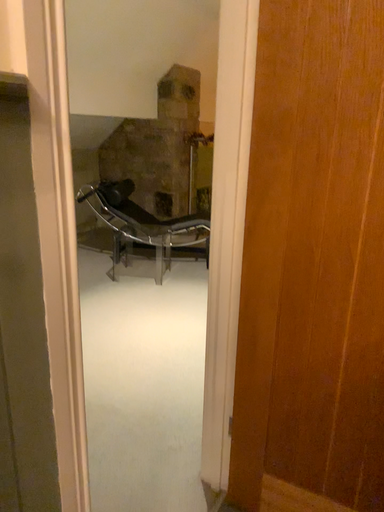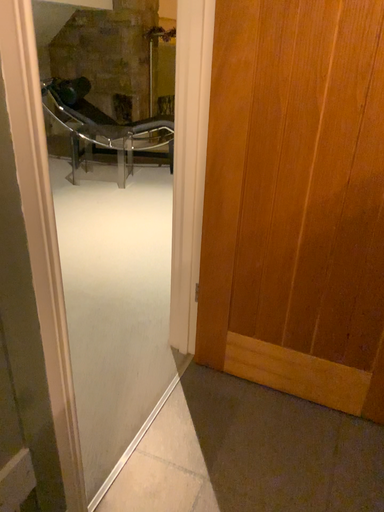
Question: Which way did the camera rotate in the video?

Choices:
 (A) rotated upward
 (B) rotated downward

Answer: (B)